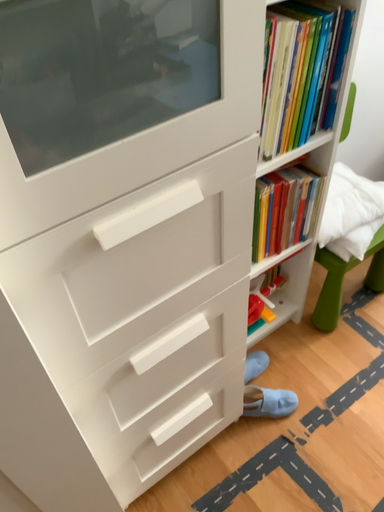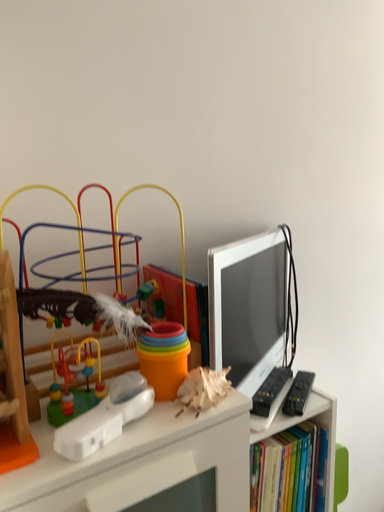
Question: Which way did the camera rotate in the video?

Choices:
 (A) rotated upward
 (B) rotated downward

Answer: (A)